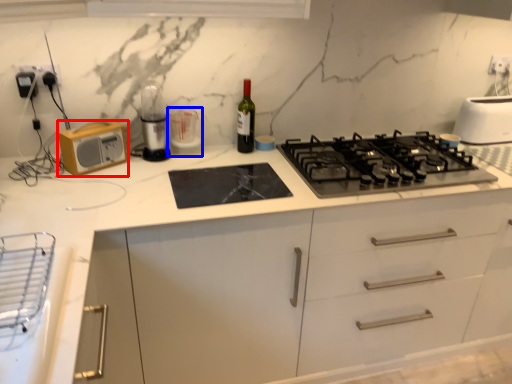
Question: Which object is closer to the camera taking this photo, kitchen appliance (highlighted by a red box) or appliance (highlighted by a blue box)?

Choices:
 (A) kitchen appliance
 (B) appliance

Answer: (A)